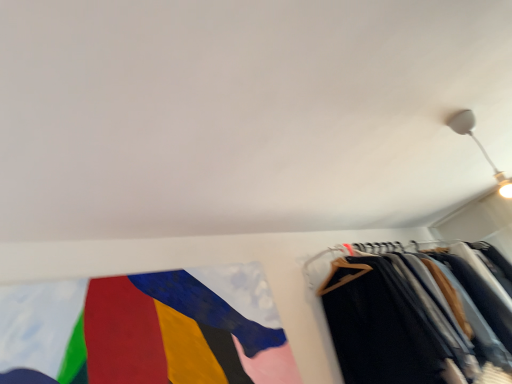
Question: Considering the relative sizes of white glossy light fixture at upper right and dark gray wool trousers at right in the image provided, is white glossy light fixture at upper right smaller than dark gray wool trousers at right?

Choices:
 (A) no
 (B) yes

Answer: (B)

Question: Does white glossy light fixture at upper right have a larger size compared to dark gray wool trousers at right?

Choices:
 (A) no
 (B) yes

Answer: (A)

Question: Is white glossy light fixture at upper right not near dark gray wool trousers at right?

Choices:
 (A) no
 (B) yes

Answer: (B)

Question: From a real-world perspective, is white glossy light fixture at upper right located higher than dark gray wool trousers at right?

Choices:
 (A) no
 (B) yes

Answer: (B)

Question: Is white glossy light fixture at upper right at the left side of dark gray wool trousers at right?

Choices:
 (A) no
 (B) yes

Answer: (B)

Question: From the image's perspective, is dark gray wool trousers at right located above or below white glossy light fixture at upper right?

Choices:
 (A) above
 (B) below

Answer: (B)

Question: In terms of size, does dark gray wool trousers at right appear bigger or smaller than white glossy light fixture at upper right?

Choices:
 (A) big
 (B) small

Answer: (A)

Question: Which is correct: dark gray wool trousers at right is inside white glossy light fixture at upper right, or outside of it?

Choices:
 (A) inside
 (B) outside

Answer: (B)

Question: From a real-world perspective, is dark gray wool trousers at right above or below white glossy light fixture at upper right?

Choices:
 (A) above
 (B) below

Answer: (B)

Question: Is textured fabric flag at lower left to the left or to the right of white glossy light fixture at upper right in the image?

Choices:
 (A) left
 (B) right

Answer: (A)

Question: In the image, is textured fabric flag at lower left positioned in front of or behind white glossy light fixture at upper right?

Choices:
 (A) front
 (B) behind

Answer: (A)

Question: From the image's perspective, relative to white glossy light fixture at upper right, is textured fabric flag at lower left above or below?

Choices:
 (A) above
 (B) below

Answer: (B)

Question: Looking at the image, does textured fabric flag at lower left seem bigger or smaller compared to white glossy light fixture at upper right?

Choices:
 (A) small
 (B) big

Answer: (B)

Question: From the image's perspective, is white glossy light fixture at upper right above or below textured fabric flag at lower left?

Choices:
 (A) above
 (B) below

Answer: (A)

Question: From a real-world perspective, is white glossy light fixture at upper right physically located above or below textured fabric flag at lower left?

Choices:
 (A) above
 (B) below

Answer: (A)